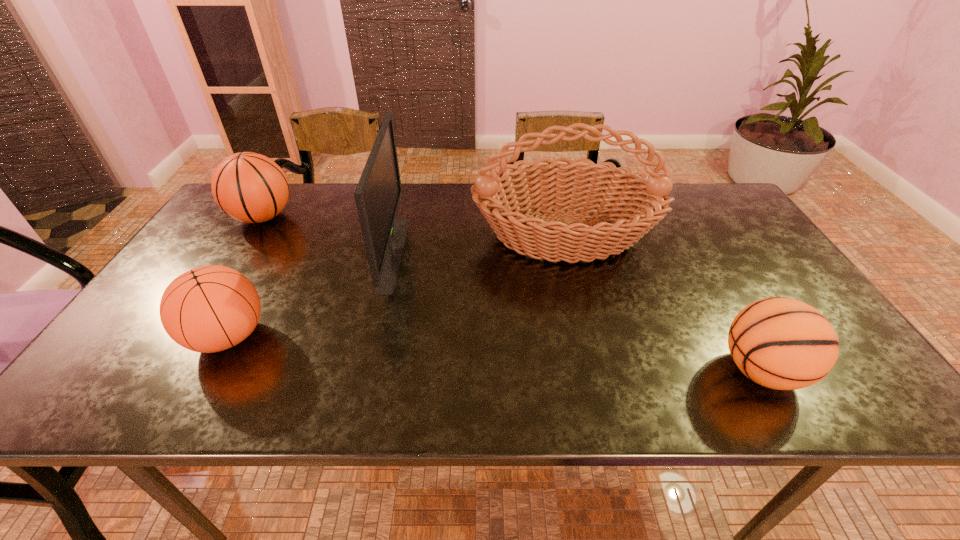
The width and height of the screenshot is (960, 540). Identify the location of basketball present at the far edge. tap(249, 187).

What are the coordinates of `object located in the near edge section of the desktop` in the screenshot? It's located at (781, 343).

Locate an element on the screen. object at the right edge is located at coordinates (781, 343).

This screenshot has width=960, height=540. Find the location of `object present at the far left corner`. object present at the far left corner is located at coordinates (249, 187).

The image size is (960, 540). What are the coordinates of `object that is at the near right corner` in the screenshot? It's located at (781, 343).

Where is `vacant space at the far edge of the desktop`? The width and height of the screenshot is (960, 540). vacant space at the far edge of the desktop is located at coordinates pyautogui.click(x=347, y=214).

The image size is (960, 540). Find the location of `free region at the near edge of the desktop`. free region at the near edge of the desktop is located at coordinates (647, 378).

Identify the location of vacant space at the left edge of the desktop. The image size is (960, 540). pos(234,239).

Locate an element on the screen. This screenshot has height=540, width=960. free location at the right edge is located at coordinates (729, 258).

This screenshot has height=540, width=960. Identify the location of free location at the far right corner of the desktop. tap(700, 183).